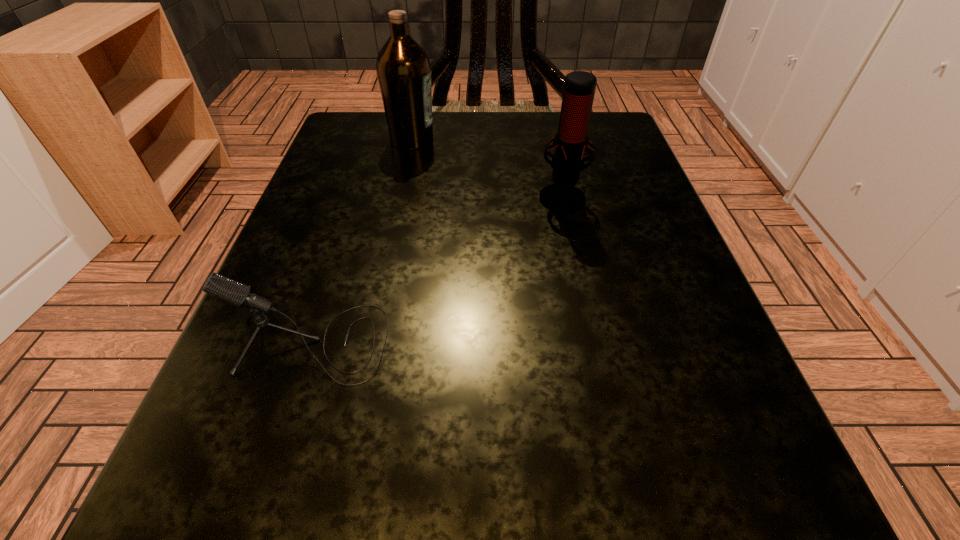
The width and height of the screenshot is (960, 540). I want to click on microphone located in the left edge section of the desktop, so click(231, 291).

You are a GUI agent. You are given a task and a screenshot of the screen. Output one action in this format:
    pyautogui.click(x=<x>, y=<y>)
    Task: Click on the object that is at the right edge
    Image resolution: width=960 pixels, height=540 pixels.
    Given the screenshot: What is the action you would take?
    pyautogui.click(x=571, y=140)

Where is `object located in the far left corner section of the desktop`? object located in the far left corner section of the desktop is located at coordinates (403, 68).

Locate an element on the screen. The image size is (960, 540). vacant space at the far edge of the desktop is located at coordinates tap(439, 173).

Locate an element on the screen. The image size is (960, 540). free spot at the left edge of the desktop is located at coordinates (340, 233).

Locate an element on the screen. This screenshot has width=960, height=540. vacant space at the right edge of the desktop is located at coordinates (697, 409).

Where is `vacant space at the far left corner`? This screenshot has width=960, height=540. vacant space at the far left corner is located at coordinates (362, 166).

The image size is (960, 540). In order to click on free region at the far right corner in this screenshot , I will do `click(623, 141)`.

In order to click on free space between the right microphone and the olive oil in this screenshot , I will do `click(487, 167)`.

The image size is (960, 540). What are the coordinates of `empty space between the right microphone and the olive oil` in the screenshot? It's located at (487, 167).